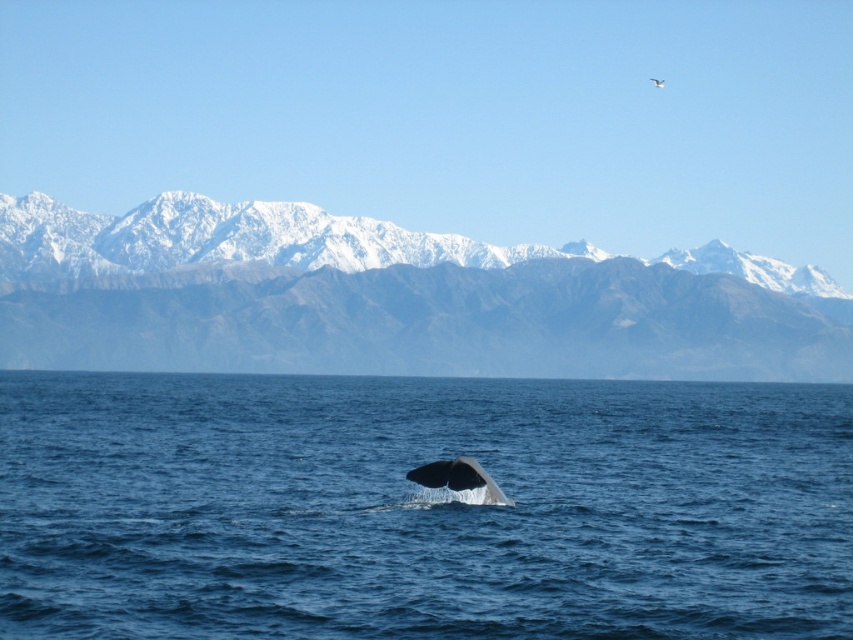
Can you confirm if snowy gray mountain range at upper center is smaller than gray smooth whale at center?

No.

At what (x,y) coordinates should I click in order to perform the action: click on snowy gray mountain range at upper center. Please return your answer as a coordinate pair (x, y). The image size is (853, 640). Looking at the image, I should click on (390, 300).

Which of these two, blue water at center or gray smooth whale at center, stands shorter?

Standing shorter between the two is gray smooth whale at center.

Who is more distant from viewer, (619, 461) or (473, 474)?

The point (619, 461) is more distant.

This screenshot has height=640, width=853. In order to click on blue water at center in this screenshot , I will do `click(421, 508)`.

Consider the image. Can you confirm if blue water at center is shorter than snowy gray mountain range at upper center?

Indeed, blue water at center has a lesser height compared to snowy gray mountain range at upper center.

This screenshot has width=853, height=640. Describe the element at coordinates (421, 508) in the screenshot. I see `blue water at center` at that location.

Where is `blue water at center`? blue water at center is located at coordinates (421, 508).